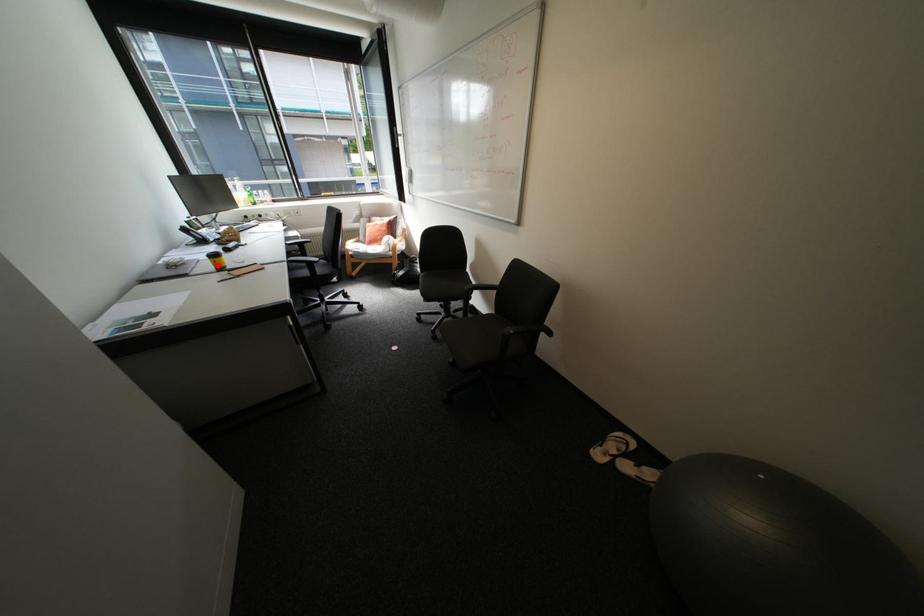
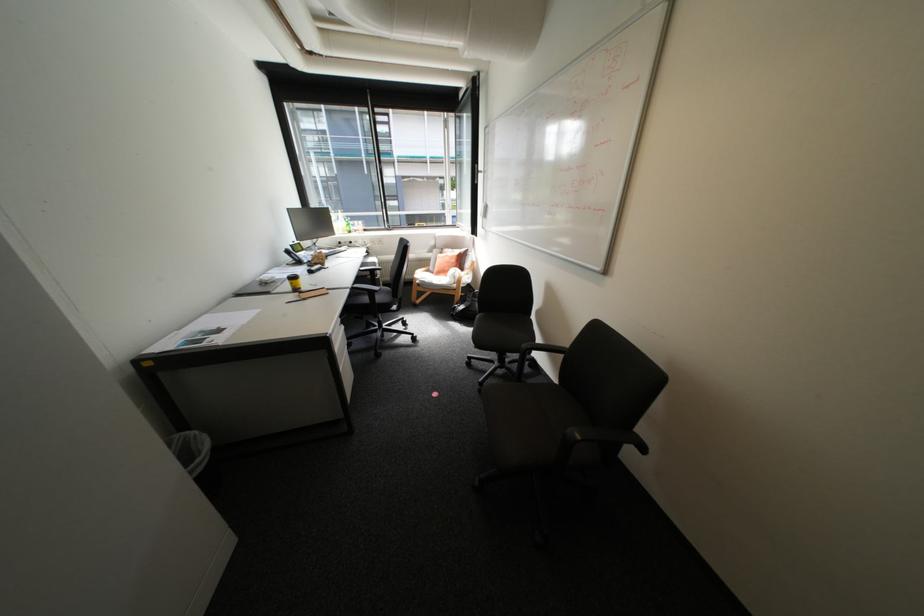
Locate, in the second image, the point that corresponds to the highlighted location in the first image.

(296, 286)